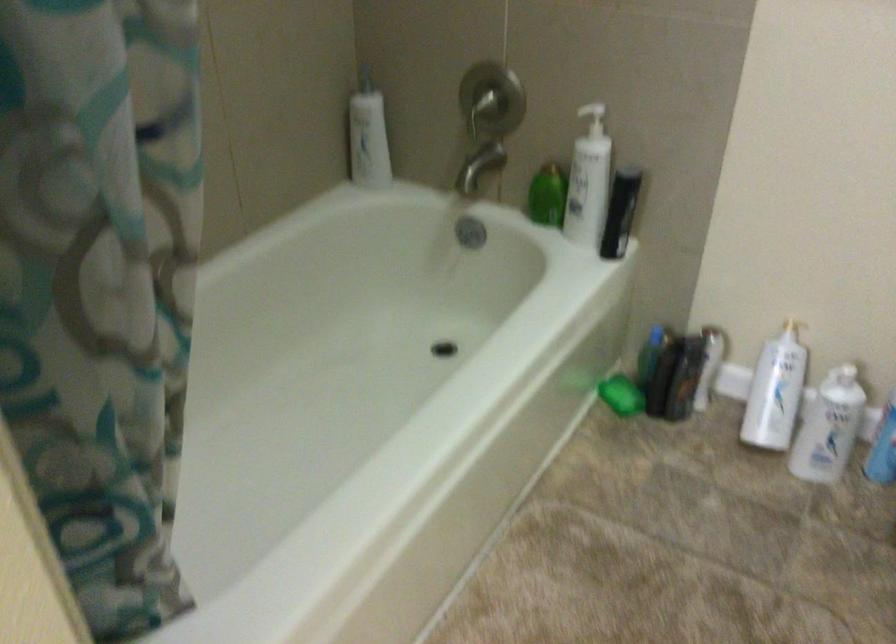
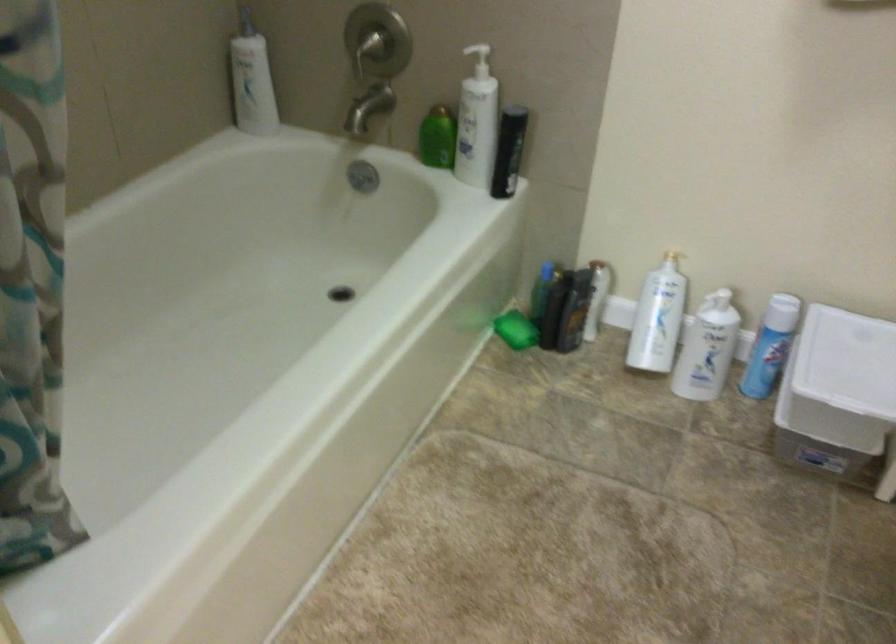
Where in the second image is the point corresponding to pixel 546 199 from the first image?

(437, 138)